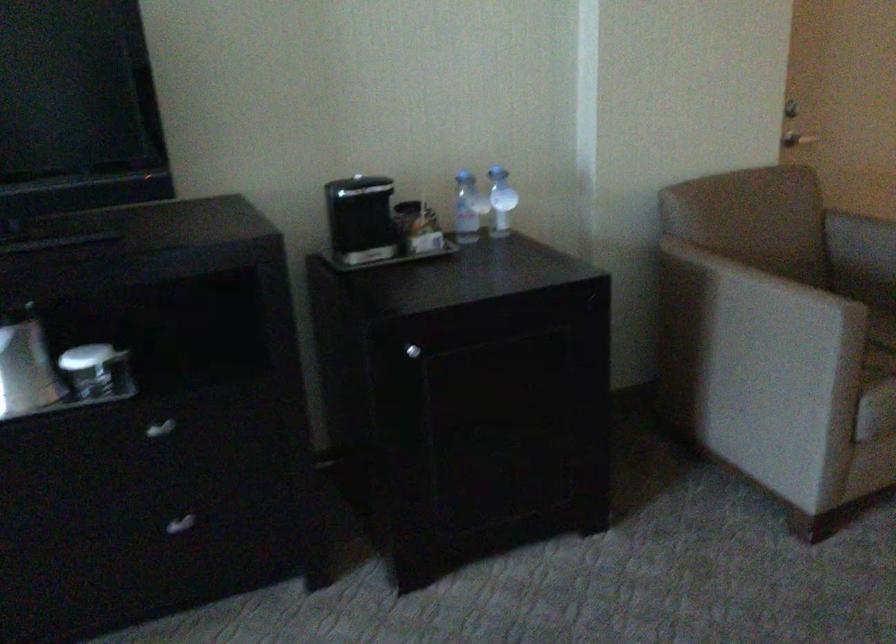
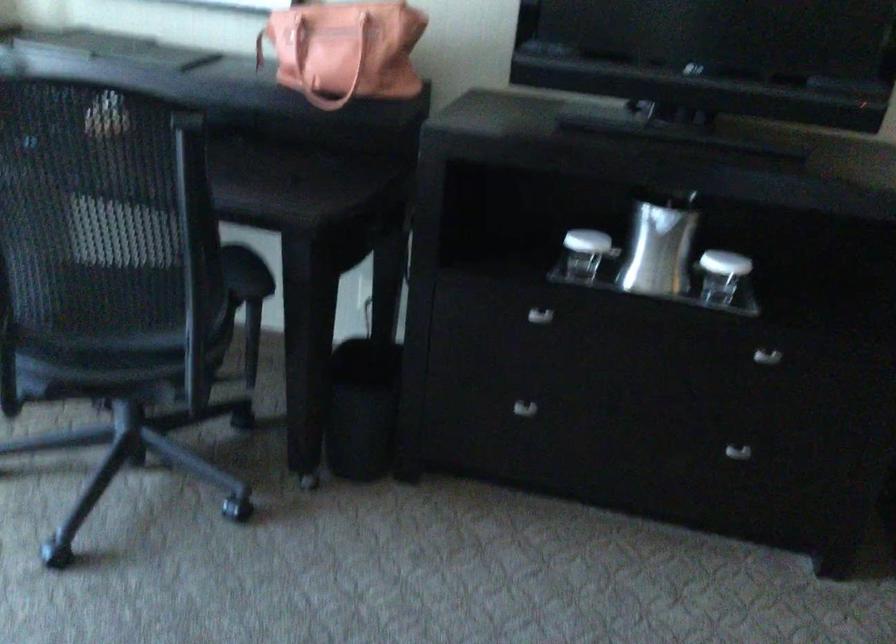
Find the pixel in the second image that matches (x=95, y=370) in the first image.

(721, 275)